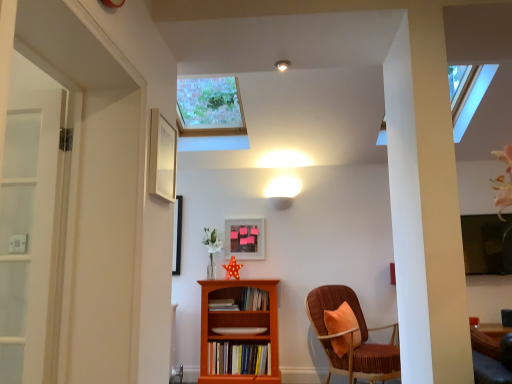
Question: From the image's perspective, is wooden book at center, which is the second book in top-to-bottom order, beneath white matte picture frame at upper center, which is counted as the first picture frame, starting from the top?

Choices:
 (A) no
 (B) yes

Answer: (B)

Question: From a real-world perspective, is wooden book at center, which is the second book in top-to-bottom order, under white matte picture frame at upper center, placed as the second picture frame when sorted from bottom to top?

Choices:
 (A) yes
 (B) no

Answer: (A)

Question: Is wooden book at center, which appears as the third book when ordered from the bottom, at the left side of white matte picture frame at upper center, placed as the second picture frame when sorted from bottom to top?

Choices:
 (A) yes
 (B) no

Answer: (B)

Question: Is wooden book at center, which is the second book in top-to-bottom order, to the right of white matte picture frame at upper center, which ranks as the 1th picture frame in left-to-right order, from the viewer's perspective?

Choices:
 (A) yes
 (B) no

Answer: (A)

Question: Is the position of wooden book at center, which is the second book in top-to-bottom order, more distant than that of white matte picture frame at upper center, which is counted as the first picture frame, starting from the top?

Choices:
 (A) no
 (B) yes

Answer: (B)

Question: Considering the positions of matte white ceiling light at upper center and white matte picture frame at upper center, the 1th picture frame in the front-to-back sequence, in the image, is matte white ceiling light at upper center wider or thinner than white matte picture frame at upper center, the 1th picture frame in the front-to-back sequence,?

Choices:
 (A) wide
 (B) thin

Answer: (A)

Question: Relative to white matte picture frame at upper center, which ranks as the 1th picture frame in left-to-right order, is matte white ceiling light at upper center in front or behind?

Choices:
 (A) behind
 (B) front

Answer: (A)

Question: From the image's perspective, is matte white ceiling light at upper center located above or below white matte picture frame at upper center, which is counted as the first picture frame, starting from the top?

Choices:
 (A) below
 (B) above

Answer: (B)

Question: In terms of height, does matte white ceiling light at upper center look taller or shorter compared to white matte picture frame at upper center, which is the second picture frame from right to left?

Choices:
 (A) short
 (B) tall

Answer: (A)

Question: From the image's perspective, relative to matte white ceiling light at upper center, is orange wood bookcase at center above or below?

Choices:
 (A) above
 (B) below

Answer: (B)

Question: Is point (251, 317) closer or farther from the camera than point (287, 64)?

Choices:
 (A) closer
 (B) farther

Answer: (B)

Question: Relative to matte white ceiling light at upper center, is orange wood bookcase at center in front or behind?

Choices:
 (A) front
 (B) behind

Answer: (B)

Question: From a real-world perspective, is orange wood bookcase at center physically located above or below matte white ceiling light at upper center?

Choices:
 (A) above
 (B) below

Answer: (B)

Question: Based on their positions, is hardcover books at center, placed as the fourth book when sorted from top to bottom, located to the left or right of matte wooden picture frame at center, the second picture frame positioned from the left?

Choices:
 (A) left
 (B) right

Answer: (A)

Question: In the image, is hardcover books at center, acting as the 1th book starting from the bottom, positioned in front of or behind matte wooden picture frame at center, which appears as the 1th picture frame when viewed from the back?

Choices:
 (A) front
 (B) behind

Answer: (A)